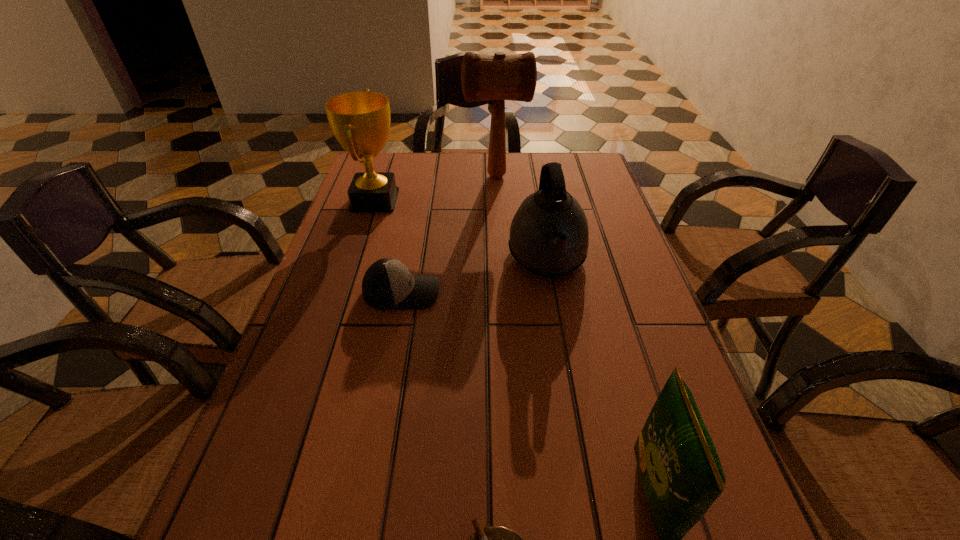
Find the location of a particular element. mallet is located at coordinates (499, 77).

The height and width of the screenshot is (540, 960). Find the location of `award`. award is located at coordinates (360, 121).

Where is `kettle`? This screenshot has width=960, height=540. kettle is located at coordinates (549, 236).

The height and width of the screenshot is (540, 960). I want to click on cap, so click(387, 284).

Locate an element on the screen. The width and height of the screenshot is (960, 540). free space located 0.100m on the strike surface of the tallest object is located at coordinates (432, 176).

The width and height of the screenshot is (960, 540). I want to click on free region located on the strike surface of the tallest object, so click(x=444, y=176).

Where is `vacant space located on the strike surface of the tallest object`? Image resolution: width=960 pixels, height=540 pixels. vacant space located on the strike surface of the tallest object is located at coordinates (404, 176).

Locate an element on the screen. The image size is (960, 540). free space located 0.200m on the front-facing side of the award is located at coordinates (469, 200).

The width and height of the screenshot is (960, 540). What are the coordinates of `free space located 0.180m at the spout of the kettle` in the screenshot? It's located at (565, 364).

This screenshot has width=960, height=540. Find the location of `vacant area situated on the front panel of the cap`. vacant area situated on the front panel of the cap is located at coordinates (470, 292).